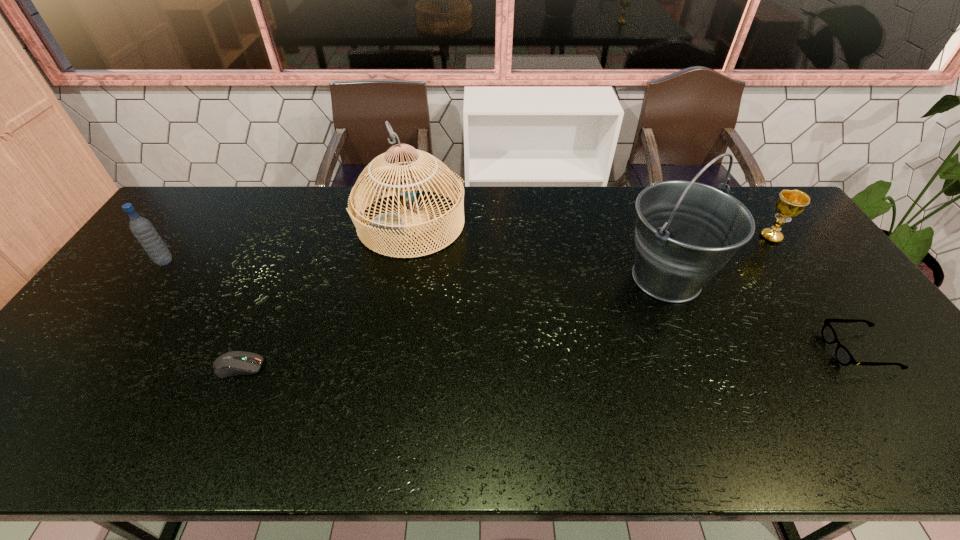
Locate an element on the screen. vacant space positioned 0.070m on the back of the leftmost object is located at coordinates (180, 241).

The width and height of the screenshot is (960, 540). In order to click on free space located 0.050m on the left of the third shortest object in this screenshot , I will do point(743,238).

Find the location of `free space located on the arms of the spectacles`. free space located on the arms of the spectacles is located at coordinates (748, 350).

Where is `vacant region located on the arms of the spectacles`? The width and height of the screenshot is (960, 540). vacant region located on the arms of the spectacles is located at coordinates (810, 350).

In order to click on free space located on the arms of the spectacles in this screenshot , I will do `click(693, 350)`.

This screenshot has height=540, width=960. Identify the location of vacant space located on the button of the second object from left to right. (400, 367).

Where is `object positioned at the far edge`? object positioned at the far edge is located at coordinates (391, 223).

This screenshot has height=540, width=960. I want to click on object at the left edge, so click(146, 234).

The height and width of the screenshot is (540, 960). I want to click on chalice positioned at the right edge, so click(790, 203).

The height and width of the screenshot is (540, 960). I want to click on spectacles located at the right edge, so click(x=843, y=356).